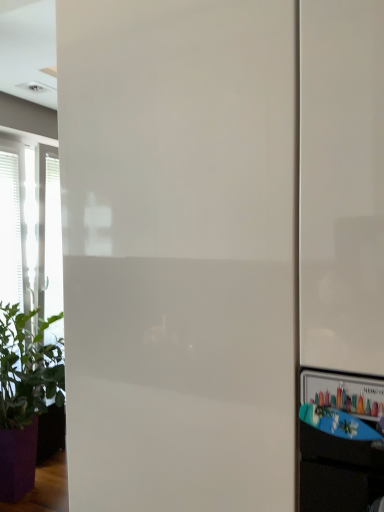
Describe the element at coordinates (25, 395) in the screenshot. I see `green leafy plant at left` at that location.

This screenshot has width=384, height=512. Identify the location of green leafy plant at left. (25, 395).

Consider the image. In order to face green leafy plant at left, should I rotate leftwards or rightwards?

A 17.659 degree turn to the left will do.

The width and height of the screenshot is (384, 512). I want to click on green leafy plant at left, so click(x=25, y=395).